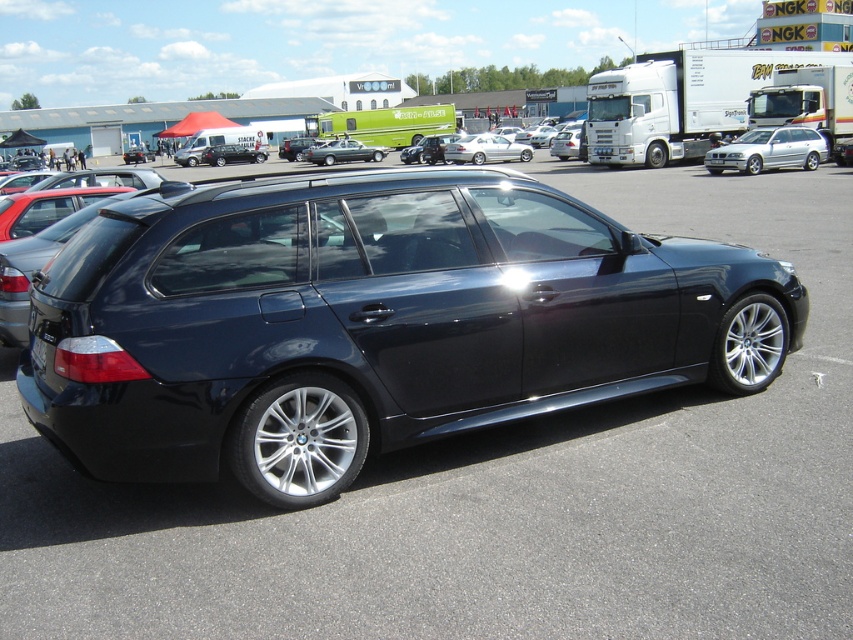
Question: Considering the real-world distances, which object is farthest from the black plastic license plate at rear?

Choices:
 (A) satin silver wagon at center
 (B) glossy dark blue minivan at center

Answer: (A)

Question: Does glossy dark blue minivan at center have a lesser width compared to silver metallic sedan at center?

Choices:
 (A) yes
 (B) no

Answer: (A)

Question: Does satin silver wagon at center have a lesser width compared to black plastic license plate at rear?

Choices:
 (A) no
 (B) yes

Answer: (A)

Question: Which object is the closest to the black plastic license plate at rear?

Choices:
 (A) silver metallic wagon at right
 (B) satin silver wagon at center
 (C) silver metallic sedan at center
 (D) glossy dark blue minivan at center

Answer: (D)

Question: Is glossy dark blue minivan at center above silver metallic wagon at right?

Choices:
 (A) yes
 (B) no

Answer: (B)

Question: Which point is farther to the camera?

Choices:
 (A) 44,353
 (B) 309,148
 (C) 706,157
 (D) 227,412

Answer: (B)